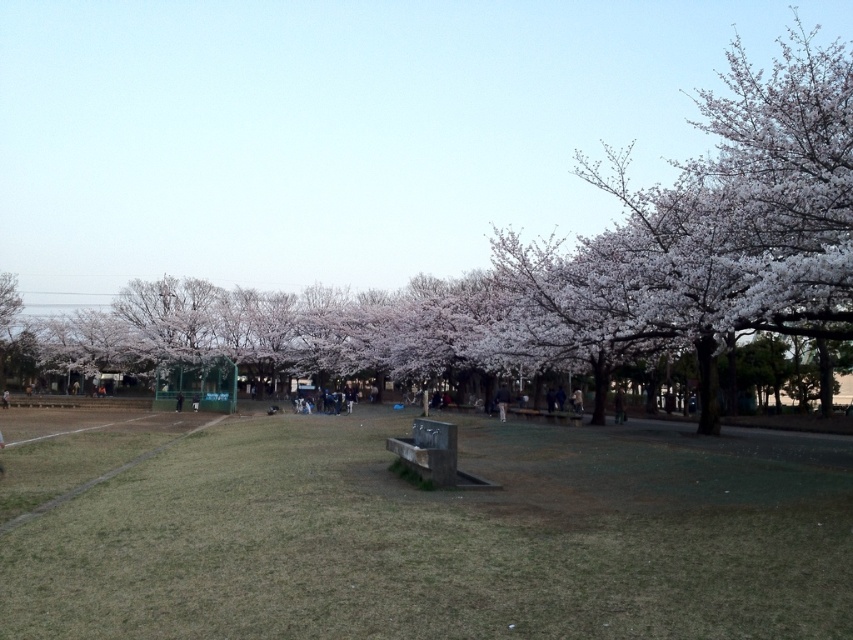
Does white blossoms at center have a lesser height compared to green grass at center?

No, white blossoms at center is not shorter than green grass at center.

This screenshot has height=640, width=853. Identify the location of white blossoms at center. (334, 131).

Does point (154, 84) come behind point (80, 525)?

Yes.

The height and width of the screenshot is (640, 853). In order to click on white blossoms at center in this screenshot , I will do `click(334, 131)`.

Is point (53, 426) positioned before point (508, 392)?

Yes.

Which is behind, point (297, 580) or point (505, 397)?

The point (505, 397) is more distant.

Describe the element at coordinates (418, 531) in the screenshot. I see `green grass at center` at that location.

Locate an element on the screen. The height and width of the screenshot is (640, 853). green grass at center is located at coordinates (418, 531).

Between white blossoms at center and dark blue jeans at center, which one is positioned lower?

dark blue jeans at center is lower down.

Which is more to the left, white blossoms at center or dark blue jeans at center?

From the viewer's perspective, white blossoms at center appears more on the left side.

Which is in front, point (512, 131) or point (502, 394)?

Positioned in front is point (502, 394).

Image resolution: width=853 pixels, height=640 pixels. I want to click on white blossoms at center, so click(334, 131).